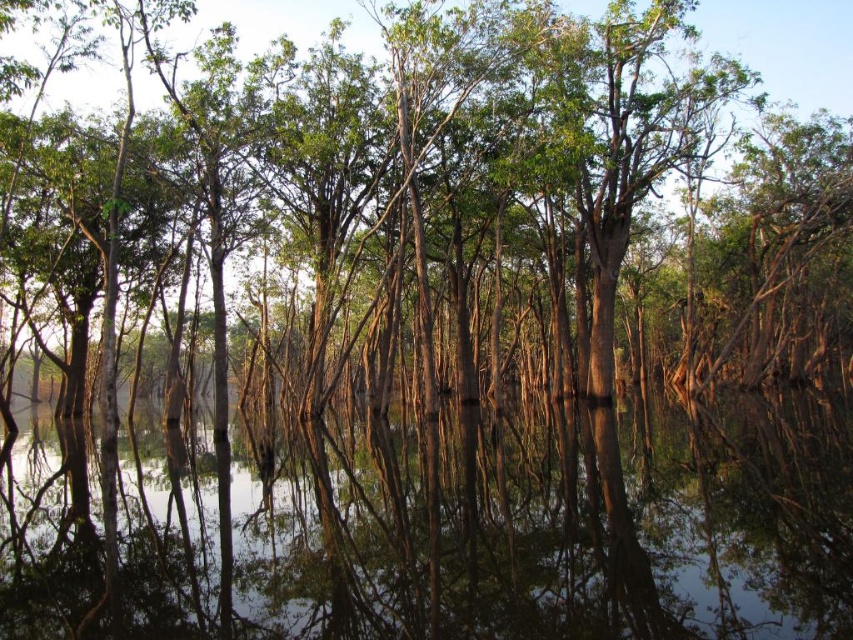
Question: Does clear water at center have a smaller size compared to green matte tree at center?

Choices:
 (A) no
 (B) yes

Answer: (B)

Question: Is clear water at center above green matte tree at center?

Choices:
 (A) no
 (B) yes

Answer: (A)

Question: Which object appears closest to the camera in this image?

Choices:
 (A) green matte tree at center
 (B) clear water at center

Answer: (B)

Question: Can you confirm if clear water at center is positioned above green matte tree at center?

Choices:
 (A) no
 (B) yes

Answer: (A)

Question: Which point appears farthest from the camera in this image?

Choices:
 (A) (372, 29)
 (B) (532, 573)

Answer: (A)